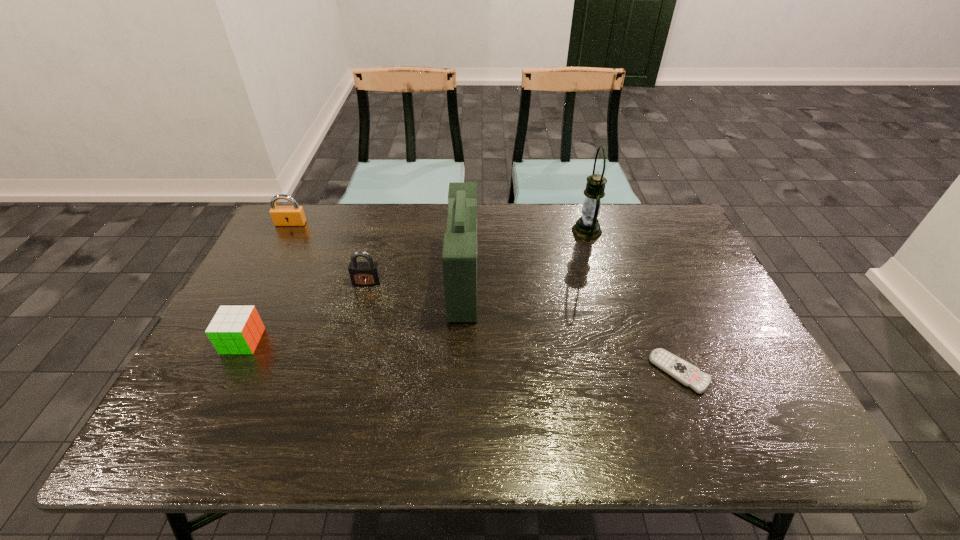
I want to click on free area in between the second tallest object and the lantern, so tap(525, 255).

Locate an element on the screen. This screenshot has width=960, height=540. empty space between the left padlock and the fourth object from left to right is located at coordinates (377, 252).

Locate an element on the screen. This screenshot has width=960, height=540. vacant area that lies between the cube and the first-aid kit is located at coordinates (353, 310).

In order to click on empty space that is in between the third object from left to right and the first-aid kit in this screenshot , I will do `click(416, 281)`.

You are a GUI agent. You are given a task and a screenshot of the screen. Output one action in this format:
    pyautogui.click(x=<x>, y=<y>)
    Task: Click on the free spot between the first-aid kit and the nearer padlock
    The width and height of the screenshot is (960, 540).
    Given the screenshot: What is the action you would take?
    pyautogui.click(x=416, y=281)

The width and height of the screenshot is (960, 540). In order to click on empty space that is in between the rightmost object and the right padlock in this screenshot , I will do `click(523, 327)`.

The image size is (960, 540). I want to click on empty location between the first-aid kit and the farther padlock, so click(x=377, y=252).

Image resolution: width=960 pixels, height=540 pixels. I want to click on free space between the farther padlock and the lantern, so [x=439, y=227].

Locate which object is the second closest to the right padlock. Please provide its 2D coordinates. Your answer should be formatted as a tuple, i.e. [(x, y)], where the tuple contains the x and y coordinates of a point satisfying the conditions above.

[(234, 329)]

In order to click on the fourth closest object relative to the lantern in this screenshot , I will do `click(294, 215)`.